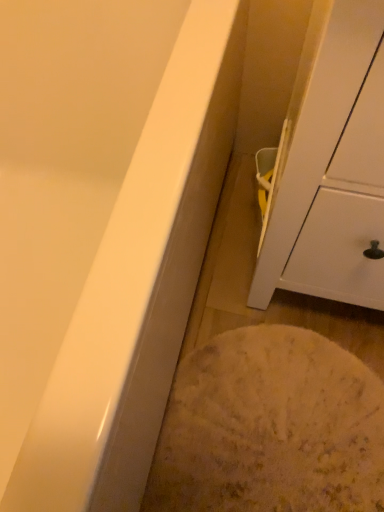
The image size is (384, 512). What are the coordinates of `white matte cabinet at right` in the screenshot? It's located at (331, 165).

What do you see at coordinates (331, 165) in the screenshot?
I see `white matte cabinet at right` at bounding box center [331, 165].

Identify the location of white textured rug at lower center. (270, 426).

Measure the distance between white textured rug at lower center and camera.

white textured rug at lower center and camera are 33.88 inches apart from each other.

What do you see at coordinates (270, 426) in the screenshot? This screenshot has width=384, height=512. I see `white textured rug at lower center` at bounding box center [270, 426].

You are a GUI agent. You are given a task and a screenshot of the screen. Output one action in this format:
    pyautogui.click(x=<x>, y=<y>)
    Task: Click on the white matte cabinet at right
    The width and height of the screenshot is (384, 512).
    Given the screenshot: What is the action you would take?
    pyautogui.click(x=331, y=165)

Between white textured rug at lower center and white matte cabinet at right, which one appears on the right side from the viewer's perspective?

From the viewer's perspective, white matte cabinet at right appears more on the right side.

Which object is more forward, white textured rug at lower center or white matte cabinet at right?

white matte cabinet at right is in front.

Which is closer to the camera, (295, 370) or (359, 191)?

Point (359, 191)

From the image's perspective, is white textured rug at lower center below white matte cabinet at right?

Yes.

From a real-world perspective, is white textured rug at lower center physically located above or below white matte cabinet at right?

In terms of real-world spatial position, white textured rug at lower center is below white matte cabinet at right.

Which object is thinner, white textured rug at lower center or white matte cabinet at right?

Thinner between the two is white textured rug at lower center.

Who is taller, white textured rug at lower center or white matte cabinet at right?

With more height is white matte cabinet at right.

In terms of size, does white textured rug at lower center appear bigger or smaller than white matte cabinet at right?

Clearly, white textured rug at lower center is smaller in size than white matte cabinet at right.

Is white textured rug at lower center inside or outside of white matte cabinet at right?

white textured rug at lower center is spatially situated outside white matte cabinet at right.

Looking at this image, would you say white textured rug at lower center is a long distance from white matte cabinet at right?

No, white textured rug at lower center is in close proximity to white matte cabinet at right.

Is white textured rug at lower center oriented towards white matte cabinet at right?

No, white textured rug at lower center is not facing towards white matte cabinet at right.

The image size is (384, 512). In the image, there is a white matte cabinet at right. Identify the location of flour below it (from a real-world perspective). click(x=270, y=426).

Which object is positioned more to the left, white matte cabinet at right or white textured rug at lower center?

Positioned to the left is white textured rug at lower center.

Is white matte cabinet at right further to camera compared to white textured rug at lower center?

No, white matte cabinet at right is in front of white textured rug at lower center.

Considering the positions of points (357, 190) and (346, 482), is point (357, 190) closer to camera compared to point (346, 482)?

Yes.

From the image's perspective, which is below, white matte cabinet at right or white textured rug at lower center?

white textured rug at lower center appears lower in the image.

From a real-world perspective, is white matte cabinet at right on white textured rug at lower center?

Yes, from a real-world perspective, white matte cabinet at right is above white textured rug at lower center.

Based on the photo, in terms of width, does white matte cabinet at right look wider or thinner when compared to white textured rug at lower center?

In the image, white matte cabinet at right appears to be wider than white textured rug at lower center.

Considering the sizes of objects white matte cabinet at right and white textured rug at lower center in the image provided, who is taller, white matte cabinet at right or white textured rug at lower center?

white matte cabinet at right is taller.

From the picture: Can you confirm if white matte cabinet at right is bigger than white textured rug at lower center?

Correct, white matte cabinet at right is larger in size than white textured rug at lower center.

Would you say white matte cabinet at right is outside white textured rug at lower center?

Absolutely, white matte cabinet at right is external to white textured rug at lower center.

Is white matte cabinet at right not close to white textured rug at lower center?

No, there isn't a large distance between white matte cabinet at right and white textured rug at lower center.

Is white matte cabinet at right positioned with its back to white textured rug at lower center?

No, white matte cabinet at right is not facing away from white textured rug at lower center.

The height and width of the screenshot is (512, 384). In the image, there is a white matte cabinet at right. In order to click on flour below it (from a real-world perspective) in this screenshot , I will do `click(270, 426)`.

Locate an element on the screen. cabinetry above the white textured rug at lower center (from a real-world perspective) is located at coordinates (331, 165).

The image size is (384, 512). In the image, there is a white textured rug at lower center. Find the location of `cabinetry above it (from the image's perspective)`. cabinetry above it (from the image's perspective) is located at coordinates (331, 165).